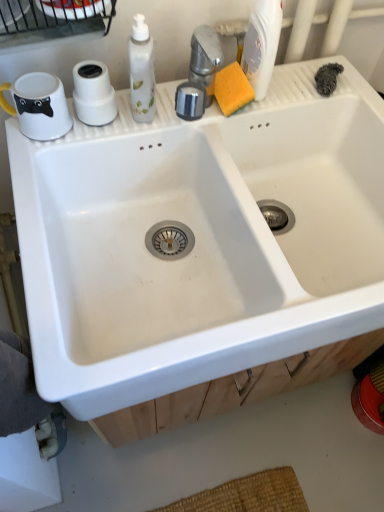
Question: Is white plastic bottle at upper right bigger or smaller than wooden drawer at lower center?

Choices:
 (A) small
 (B) big

Answer: (A)

Question: Is white plastic bottle at upper right spatially inside wooden drawer at lower center, or outside of it?

Choices:
 (A) inside
 (B) outside

Answer: (B)

Question: Based on their relative distances, which object is nearer to the white plastic bottle at upper right?

Choices:
 (A) white ceramic sink at center
 (B) wooden drawer at lower center
 (C) white matte toilet paper at upper left

Answer: (C)

Question: Based on their relative distances, which object is farther from the white matte toilet paper at upper left?

Choices:
 (A) white plastic bottle at upper right
 (B) wooden drawer at lower center
 (C) white ceramic sink at center

Answer: (B)